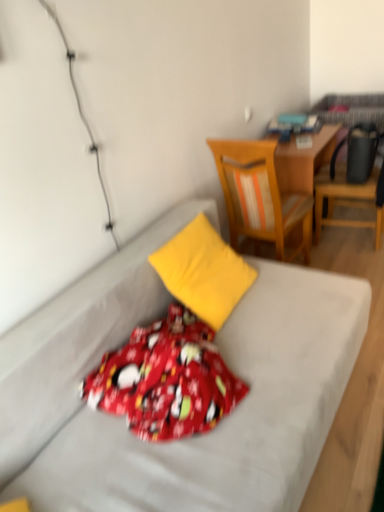
Question: Is wooden desk at center located outside red cotton blanket at center?

Choices:
 (A) yes
 (B) no

Answer: (A)

Question: Considering the relative sizes of wooden desk at center and red cotton blanket at center in the image provided, is wooden desk at center taller than red cotton blanket at center?

Choices:
 (A) no
 (B) yes

Answer: (B)

Question: Does wooden desk at center turn towards red cotton blanket at center?

Choices:
 (A) no
 (B) yes

Answer: (A)

Question: Is wooden desk at center closer to camera compared to red cotton blanket at center?

Choices:
 (A) yes
 (B) no

Answer: (B)

Question: From a real-world perspective, is wooden desk at center on red cotton blanket at center?

Choices:
 (A) yes
 (B) no

Answer: (B)

Question: Considering the relative positions of yellow fabric bed at center and wooden chair at upper right, positioned as the first chair in right-to-left order, in the image provided, is yellow fabric bed at center to the left or to the right of wooden chair at upper right, positioned as the first chair in right-to-left order,?

Choices:
 (A) left
 (B) right

Answer: (A)

Question: From the image's perspective, is yellow fabric bed at center positioned above or below wooden chair at upper right, positioned as the first chair in right-to-left order?

Choices:
 (A) above
 (B) below

Answer: (B)

Question: In terms of height, does yellow fabric bed at center look taller or shorter compared to wooden chair at upper right, the second chair positioned from the left?

Choices:
 (A) tall
 (B) short

Answer: (B)

Question: Considering the positions of yellow fabric bed at center and wooden chair at upper right, positioned as the first chair in right-to-left order, in the image, is yellow fabric bed at center bigger or smaller than wooden chair at upper right, positioned as the first chair in right-to-left order,?

Choices:
 (A) small
 (B) big

Answer: (B)

Question: Does point (228, 262) appear closer or farther from the camera than point (372, 226)?

Choices:
 (A) closer
 (B) farther

Answer: (A)

Question: From a real-world perspective, is yellow fabric pillow at center above or below wooden chair at upper right, positioned as the first chair in right-to-left order?

Choices:
 (A) above
 (B) below

Answer: (A)

Question: Considering the relative positions of yellow fabric pillow at center and wooden chair at upper right, positioned as the first chair in right-to-left order, in the image provided, is yellow fabric pillow at center to the left or to the right of wooden chair at upper right, positioned as the first chair in right-to-left order,?

Choices:
 (A) left
 (B) right

Answer: (A)

Question: Considering the positions of yellow fabric pillow at center and wooden chair at upper right, the second chair positioned from the left, in the image, is yellow fabric pillow at center bigger or smaller than wooden chair at upper right, the second chair positioned from the left,?

Choices:
 (A) small
 (B) big

Answer: (A)

Question: Is wooden chair at upper right, the second chair positioned from the left, wider or thinner than yellow fabric bed at center?

Choices:
 (A) thin
 (B) wide

Answer: (A)

Question: Is point (380, 170) closer or farther from the camera than point (213, 467)?

Choices:
 (A) farther
 (B) closer

Answer: (A)